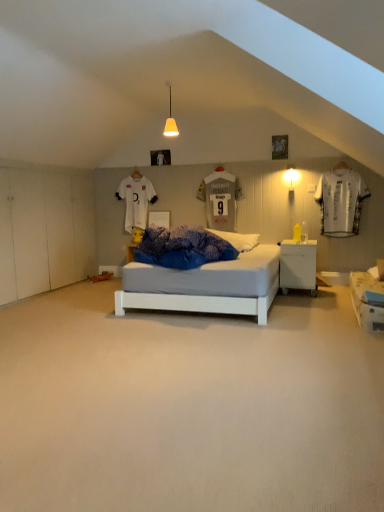
I want to click on free spot in front of white glossy nightstand at center, so click(x=306, y=296).